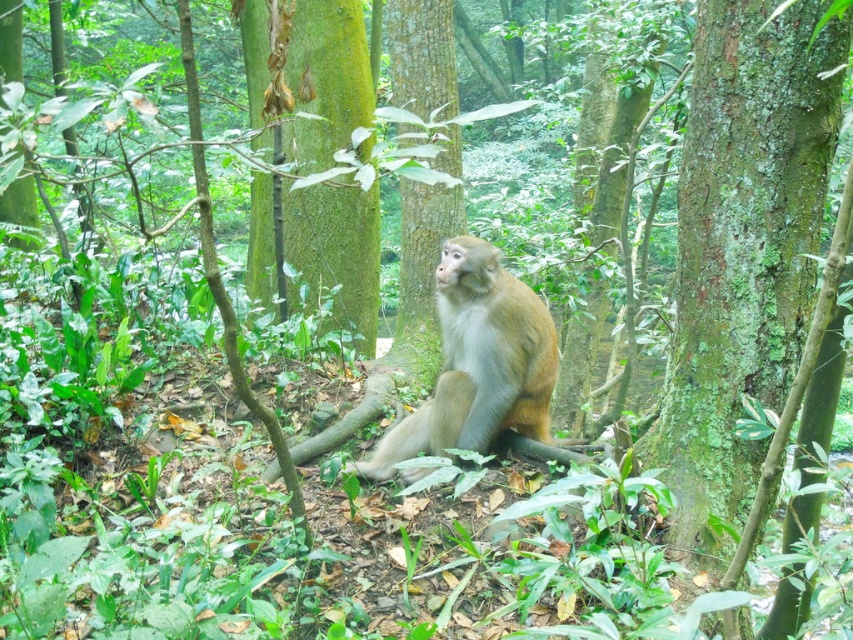
Does green mossy bark tree at center appear over golden fur monkey at center?

Indeed, green mossy bark tree at center is positioned over golden fur monkey at center.

Is green mossy bark tree at center in front of golden fur monkey at center?

That is True.

Between point (805, 266) and point (547, 314), which one is positioned in front?

Point (805, 266) is more forward.

Locate an element on the screen. green mossy bark tree at center is located at coordinates (743, 248).

Who is higher up, golden fur monkey at center or green rough bark tree at center?

Positioned higher is green rough bark tree at center.

Measure the distance from golden fur monkey at center to green rough bark tree at center.

A distance of 4.72 feet exists between golden fur monkey at center and green rough bark tree at center.

Which is in front, point (527, 292) or point (438, 116)?

Point (527, 292) is in front.

Where is `golden fur monkey at center`? Image resolution: width=853 pixels, height=640 pixels. golden fur monkey at center is located at coordinates point(479,364).

Who is positioned more to the left, green mossy tree trunk at center or green rough bark tree at center?

green mossy tree trunk at center is more to the left.

Between green mossy tree trunk at center and green rough bark tree at center, which one has less height?

green rough bark tree at center is shorter.

I want to click on green mossy tree trunk at center, so click(335, 256).

You are a GUI agent. You are given a task and a screenshot of the screen. Output one action in this format:
    pyautogui.click(x=<x>, y=<y>)
    Task: Click on the green mossy tree trunk at center
    This screenshot has width=853, height=640.
    Given the screenshot: What is the action you would take?
    pyautogui.click(x=335, y=256)